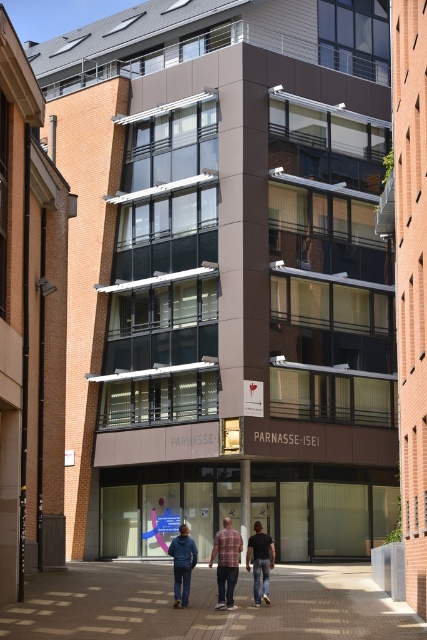
Does brown brick pavement at lower center have a larger size compared to plaid fabric shirt at center?

Correct, brown brick pavement at lower center is larger in size than plaid fabric shirt at center.

Is brown brick pavement at lower center to the left of plaid fabric shirt at center from the viewer's perspective?

Correct, you'll find brown brick pavement at lower center to the left of plaid fabric shirt at center.

Who is more distant from viewer, (116,588) or (213,548)?

The point (213,548) is more distant.

Locate an element on the screen. The width and height of the screenshot is (427, 640). brown brick pavement at lower center is located at coordinates tap(205, 605).

Consider the image. Does brown brick pavement at lower center appear under denim pants at center?

Yes.

Is brown brick pavement at lower center further to the viewer compared to denim pants at center?

No, it is not.

Locate an element on the screen. brown brick pavement at lower center is located at coordinates (205, 605).

Does brown brick pavement at lower center appear on the right side of dark blue jeans at center?

In fact, brown brick pavement at lower center is to the left of dark blue jeans at center.

Between brown brick pavement at lower center and dark blue jeans at center, which one appears on the left side from the viewer's perspective?

brown brick pavement at lower center is more to the left.

Image resolution: width=427 pixels, height=640 pixels. What are the coordinates of `brown brick pavement at lower center` in the screenshot? It's located at (205, 605).